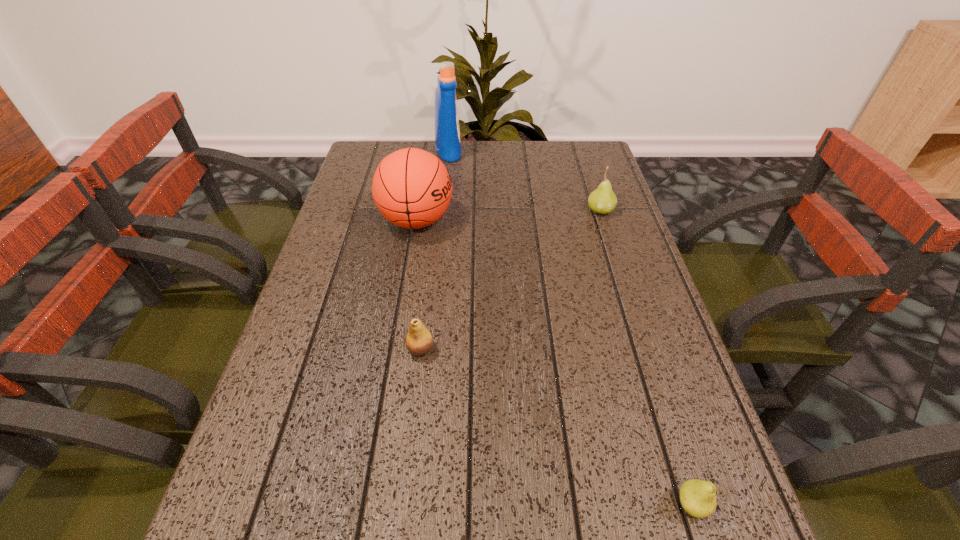
Where is `vacant space in between the leftmost pear and the farthest pear`? The width and height of the screenshot is (960, 540). vacant space in between the leftmost pear and the farthest pear is located at coordinates (511, 280).

At what (x,y) coordinates should I click in order to perform the action: click on vacant region between the farthest object and the leftmost pear. Please return your answer as a coordinate pair (x, y). Image resolution: width=960 pixels, height=540 pixels. Looking at the image, I should click on (435, 250).

I want to click on vacant area that lies between the second farthest pear and the nearest pear, so click(556, 427).

This screenshot has height=540, width=960. In order to click on empty space between the detergent and the nearest pear in this screenshot , I will do `click(570, 328)`.

Where is `empty location between the farthest object and the nearest pear`? The height and width of the screenshot is (540, 960). empty location between the farthest object and the nearest pear is located at coordinates (570, 328).

Find the location of a particular element. free space between the second farthest pear and the farthest object is located at coordinates (435, 250).

The height and width of the screenshot is (540, 960). Find the location of `empty space that is in between the second nearest pear and the tallest object`. empty space that is in between the second nearest pear and the tallest object is located at coordinates point(435,250).

Identify which object is the nearest to the nearest object. Please provide its 2D coordinates. Your answer should be formatted as a tuple, i.e. [(x, y)], where the tuple contains the x and y coordinates of a point satisfying the conditions above.

[(419, 341)]

The height and width of the screenshot is (540, 960). Identify the location of object that is the fourth closest to the second nearest pear. (447, 132).

Image resolution: width=960 pixels, height=540 pixels. Identify the location of pear that is the second nearest to the farthest pear. (697, 497).